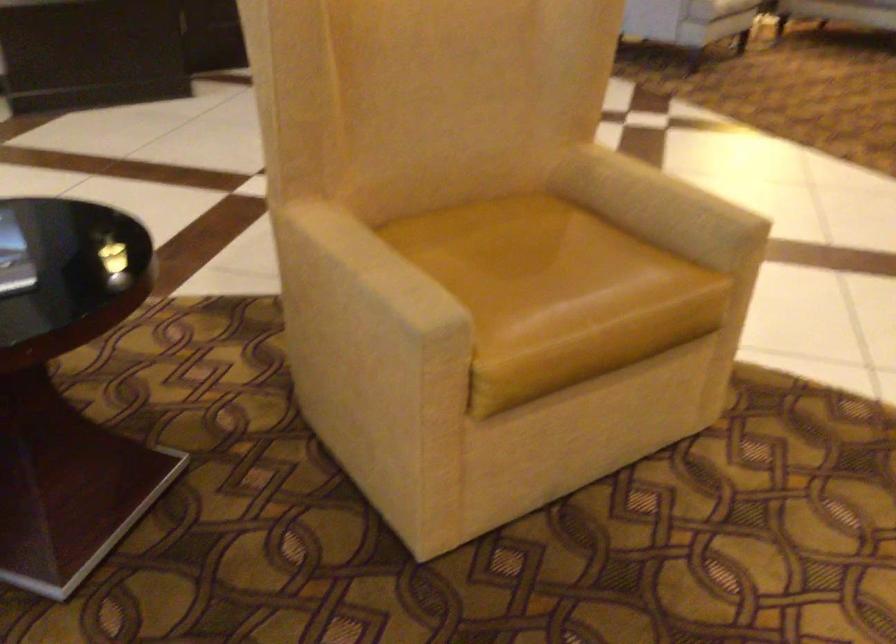
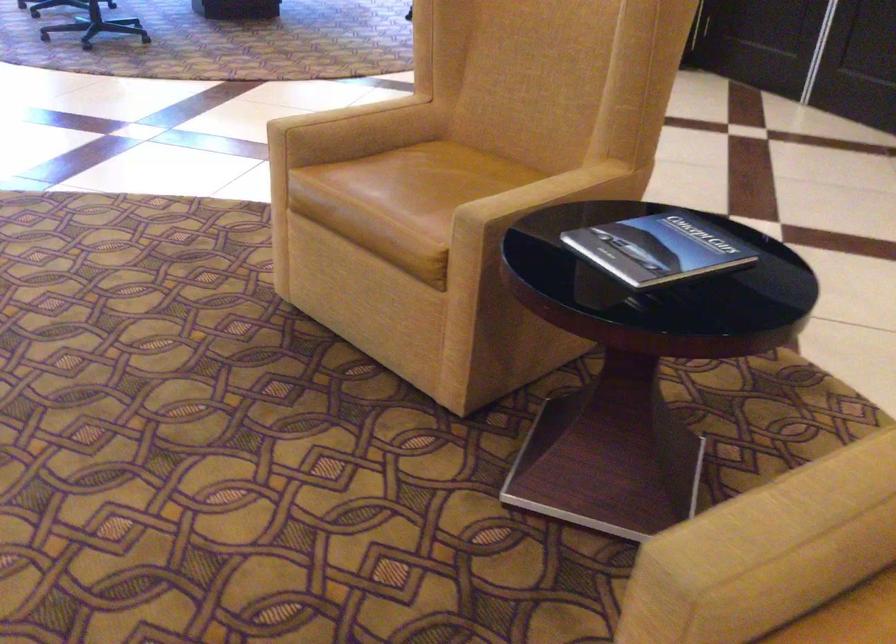
The point at [421,281] is marked in the first image. Where is the corresponding point in the second image?

(778, 543)